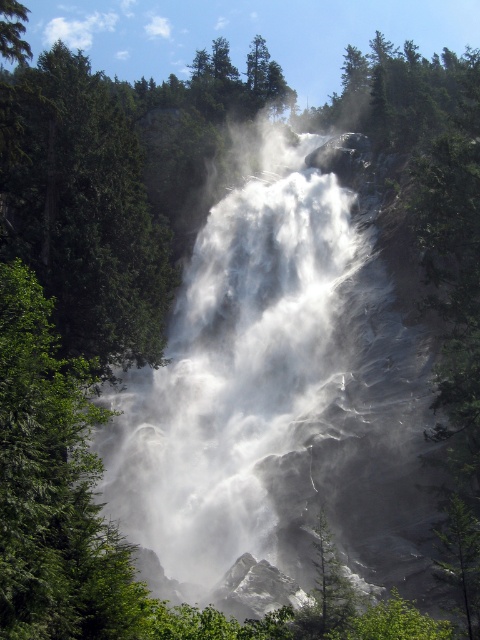
Who is positioned more to the right, green leafy tree at left or green matte tree at center?

green matte tree at center

Does green leafy tree at left lie in front of green matte tree at center?

Yes.

Which is behind, point (117, 618) or point (332, 556)?

Positioned behind is point (332, 556).

At what (x,y) coordinates should I click in order to perform the action: click on green leafy tree at left. Please return your answer as a coordinate pair (x, y). Looking at the image, I should click on (54, 486).